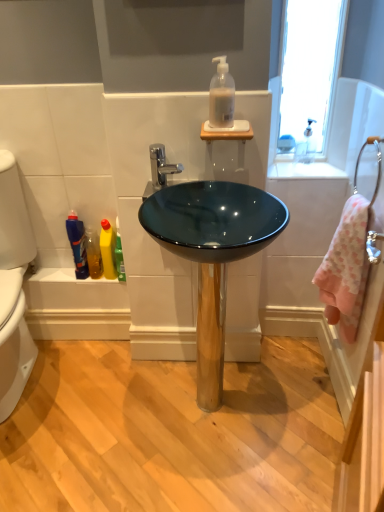
Question: Is there a large distance between translucent yellow liquid at lower left and pink terry cloth towel at right?

Choices:
 (A) yes
 (B) no

Answer: (B)

Question: Is translucent yellow liquid at lower left next to pink terry cloth towel at right and touching it?

Choices:
 (A) yes
 (B) no

Answer: (B)

Question: Does translucent yellow liquid at lower left turn towards pink terry cloth towel at right?

Choices:
 (A) yes
 (B) no

Answer: (B)

Question: Considering the relative sizes of translucent yellow liquid at lower left and pink terry cloth towel at right in the image provided, is translucent yellow liquid at lower left thinner than pink terry cloth towel at right?

Choices:
 (A) yes
 (B) no

Answer: (A)

Question: Is translucent yellow liquid at lower left bigger than pink terry cloth towel at right?

Choices:
 (A) no
 (B) yes

Answer: (A)

Question: From a real-world perspective, is white glossy countertop at upper right physically located above or below blue glossy mouthwash at lower left?

Choices:
 (A) above
 (B) below

Answer: (A)

Question: Based on their sizes in the image, would you say white glossy countertop at upper right is bigger or smaller than blue glossy mouthwash at lower left?

Choices:
 (A) big
 (B) small

Answer: (A)

Question: Is white glossy countertop at upper right to the left or to the right of blue glossy mouthwash at lower left in the image?

Choices:
 (A) right
 (B) left

Answer: (A)

Question: Considering the positions of point (294, 176) and point (81, 257), is point (294, 176) closer or farther from the camera than point (81, 257)?

Choices:
 (A) closer
 (B) farther

Answer: (A)

Question: Based on their sizes in the image, would you say translucent plastic soap dispenser at upper center, arranged as the first cleaning product when viewed from the front, is bigger or smaller than white glossy countertop at upper right?

Choices:
 (A) big
 (B) small

Answer: (B)

Question: Do you think translucent plastic soap dispenser at upper center, the first cleaning product positioned from the top, is within white glossy countertop at upper right, or outside of it?

Choices:
 (A) outside
 (B) inside

Answer: (A)

Question: Looking at their shapes, would you say translucent plastic soap dispenser at upper center, acting as the first cleaning product starting from the right, is wider or thinner than white glossy countertop at upper right?

Choices:
 (A) thin
 (B) wide

Answer: (A)

Question: Is translucent plastic soap dispenser at upper center, the 2th cleaning product in the bottom-to-top sequence, in front of or behind white glossy countertop at upper right in the image?

Choices:
 (A) behind
 (B) front

Answer: (B)

Question: Is pink terry cloth towel at right in front of or behind blue glossy mouthwash at lower left in the image?

Choices:
 (A) front
 (B) behind

Answer: (A)

Question: In terms of width, does pink terry cloth towel at right look wider or thinner when compared to blue glossy mouthwash at lower left?

Choices:
 (A) wide
 (B) thin

Answer: (A)